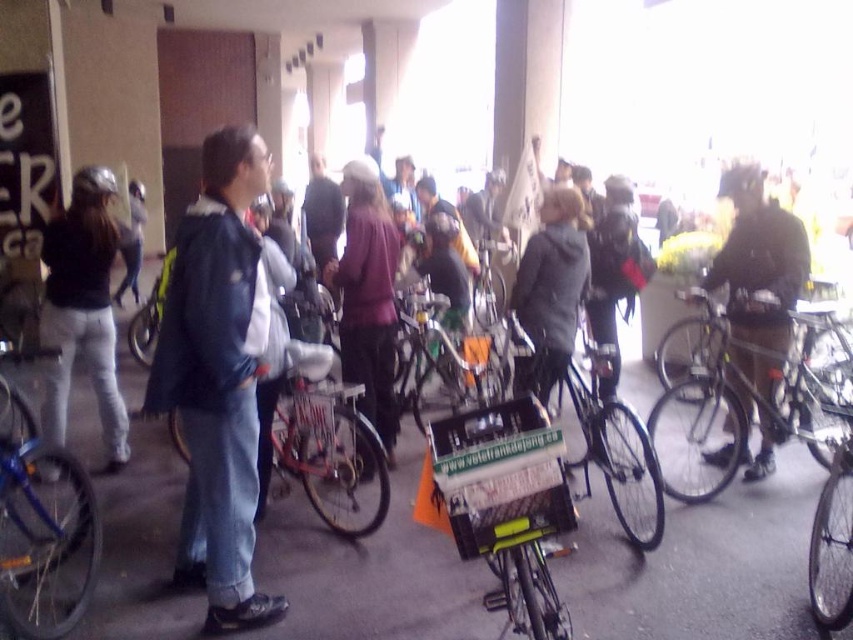
Based on the photo, is shiny silver bicycle at right shorter than metallic silver bicycle at center?

Incorrect, shiny silver bicycle at right's height does not fall short of metallic silver bicycle at center's.

Which is more to the right, shiny silver bicycle at right or metallic silver bicycle at center?

shiny silver bicycle at right

Identify the location of shiny silver bicycle at right. The width and height of the screenshot is (853, 640). (740, 403).

Which is more to the left, denim jacket at center or metallic silver bicycle at center?

denim jacket at center is more to the left.

In the scene shown: Who is higher up, denim jacket at center or metallic silver bicycle at center?

denim jacket at center is above.

Who is more forward, (233, 205) or (401, 301)?

Point (233, 205)

The height and width of the screenshot is (640, 853). Identify the location of denim jacket at center. tap(218, 380).

Is shiny metallic bicycle at center bigger than shiny metallic bicycle at lower right?

Yes, shiny metallic bicycle at center is bigger than shiny metallic bicycle at lower right.

Between shiny metallic bicycle at center and shiny metallic bicycle at lower right, which one has less height?

shiny metallic bicycle at lower right

At what (x,y) coordinates should I click in order to perform the action: click on shiny metallic bicycle at center. Please return your answer as a coordinate pair (x, y). Looking at the image, I should click on (614, 448).

Locate an element on the screen. shiny metallic bicycle at center is located at coordinates (614, 448).